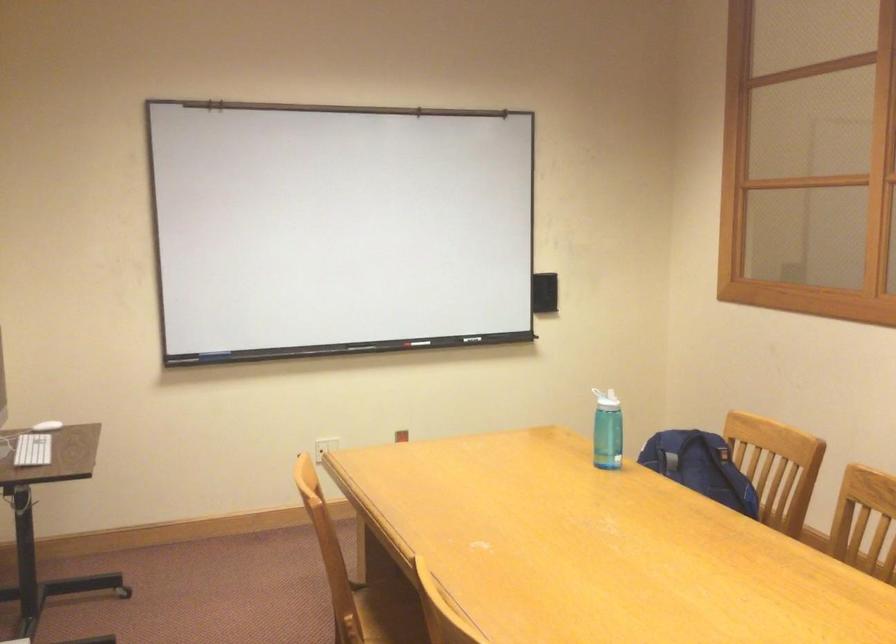
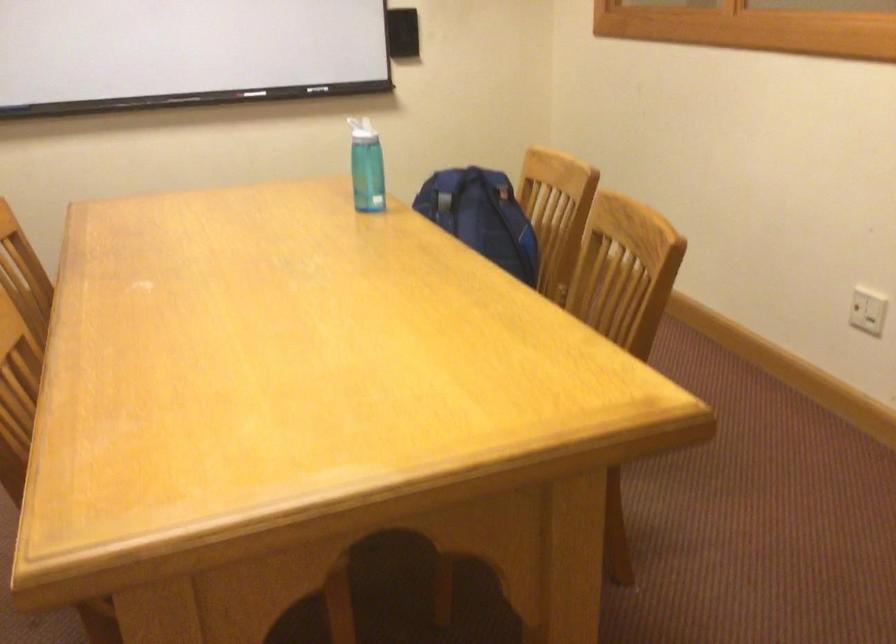
Find the pixel in the second image that matches point 602,402 in the first image.

(362, 129)